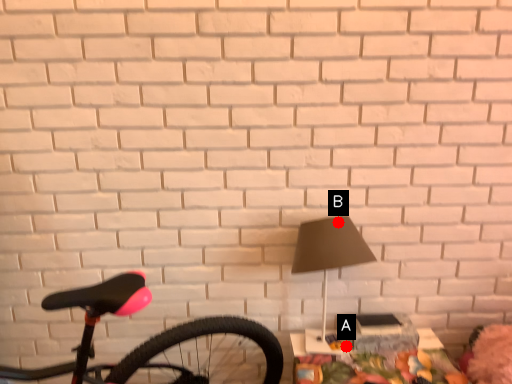
Question: Two points are circled on the image, labeled by A and B beside each circle. Which point appears farthest from the camera in this image?

Choices:
 (A) A is further
 (B) B is further

Answer: (A)